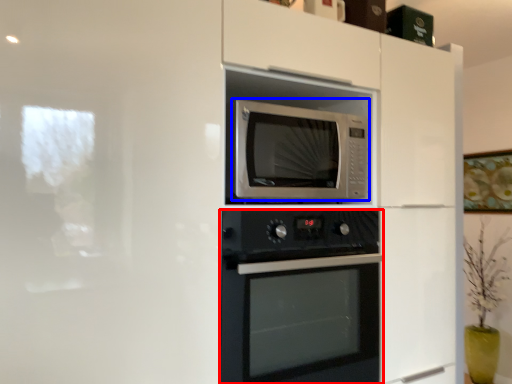
Question: Among these objects, which one is farthest to the camera, oven (highlighted by a red box) or microwave oven (highlighted by a blue box)?

Choices:
 (A) oven
 (B) microwave oven

Answer: (B)